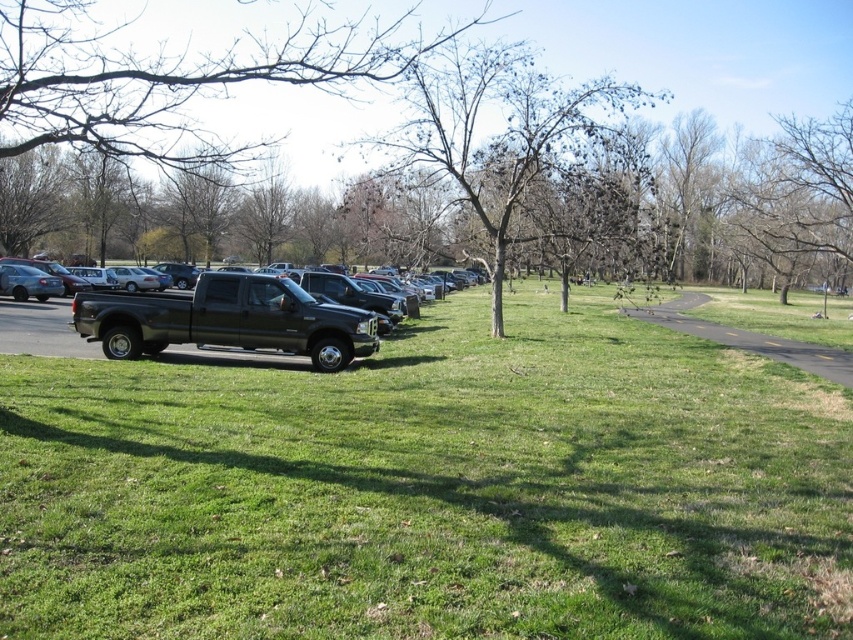
You are a pedestrian standing at the edge of the grassy field and want to walk to the parking lot. There are bare branches at center and a matte black truck at center in your path. Which object will you encounter first?

You will encounter the bare branches at center first because the matte black truck at center is located behind them.

You are standing at the edge of the parking lot and want to walk to the green grassy field at center. Which direction should you walk relative to the matte black truck at center?

You should walk to the right of the matte black truck at center to reach the green grassy field at center since the green grassy field at center is located to the right of the matte black truck at center.